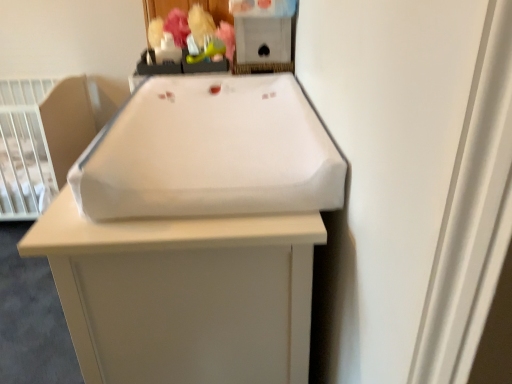
Question: From a real-world perspective, is matte plastic toy at upper center, arranged as the second toy when viewed from the right, positioned over green rubber toy at upper center, acting as the first toy starting from the right, based on gravity?

Choices:
 (A) yes
 (B) no

Answer: (A)

Question: Does matte plastic toy at upper center, arranged as the second toy when viewed from the right, appear on the left side of green rubber toy at upper center, the 2th toy viewed from the left?

Choices:
 (A) no
 (B) yes

Answer: (B)

Question: Is matte plastic toy at upper center, the first toy viewed from the left, completely or partially outside of green rubber toy at upper center, acting as the first toy starting from the right?

Choices:
 (A) no
 (B) yes

Answer: (B)

Question: Is matte plastic toy at upper center, the first toy viewed from the left, placed right next to green rubber toy at upper center, the 2th toy viewed from the left?

Choices:
 (A) no
 (B) yes

Answer: (A)

Question: Is matte plastic toy at upper center, arranged as the second toy when viewed from the right, closer to camera compared to green rubber toy at upper center, the 2th toy viewed from the left?

Choices:
 (A) no
 (B) yes

Answer: (A)

Question: Is point (4, 173) closer or farther from the camera than point (185, 59)?

Choices:
 (A) farther
 (B) closer

Answer: (A)

Question: Considering the positions of white plastic infant bed at left and green rubber toy at upper center, the 2th toy viewed from the left, in the image, is white plastic infant bed at left wider or thinner than green rubber toy at upper center, the 2th toy viewed from the left,?

Choices:
 (A) thin
 (B) wide

Answer: (B)

Question: Relative to green rubber toy at upper center, acting as the first toy starting from the right, is white plastic infant bed at left in front or behind?

Choices:
 (A) front
 (B) behind

Answer: (B)

Question: Is white plastic infant bed at left to the left or to the right of green rubber toy at upper center, the 2th toy viewed from the left, in the image?

Choices:
 (A) right
 (B) left

Answer: (B)

Question: Considering the relative positions of white plastic infant bed at left and white fabric changing pad at center in the image provided, is white plastic infant bed at left to the left or to the right of white fabric changing pad at center?

Choices:
 (A) right
 (B) left

Answer: (B)

Question: Does point (1, 168) appear closer or farther from the camera than point (83, 327)?

Choices:
 (A) farther
 (B) closer

Answer: (A)

Question: From their relative heights in the image, would you say white plastic infant bed at left is taller or shorter than white fabric changing pad at center?

Choices:
 (A) tall
 (B) short

Answer: (B)

Question: In the image, is white plastic infant bed at left positioned in front of or behind white fabric changing pad at center?

Choices:
 (A) front
 (B) behind

Answer: (B)

Question: Is green rubber toy at upper center, the 2th toy viewed from the left, inside or outside of white plastic infant bed at left?

Choices:
 (A) inside
 (B) outside

Answer: (B)

Question: Is green rubber toy at upper center, acting as the first toy starting from the right, wider or thinner than white plastic infant bed at left?

Choices:
 (A) thin
 (B) wide

Answer: (A)